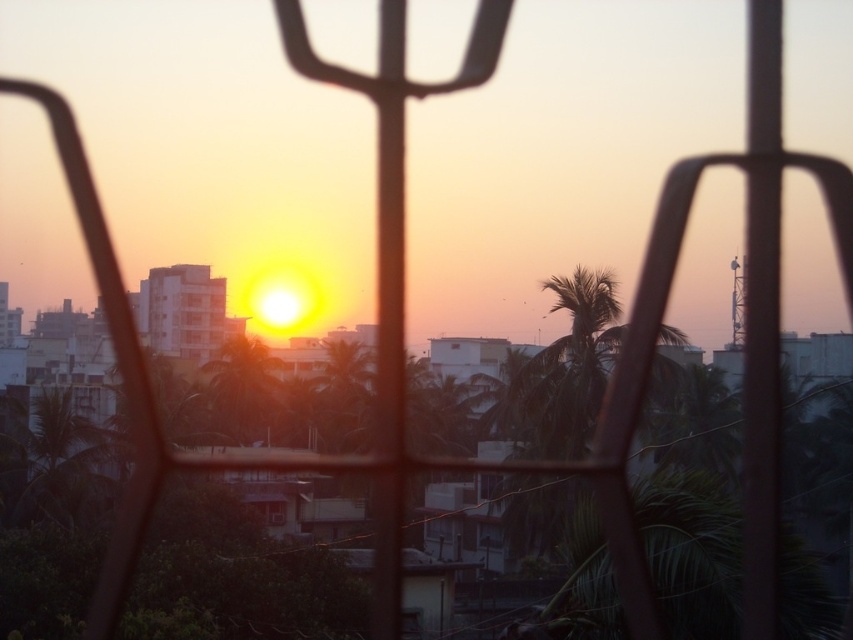
You are standing in front of a window with a metal grid and looking at the sunset. There are two points marked on the grid at coordinates point (262, 403) and point (265, 509). Which of these two points is closer to you?

Point (262, 403) is further to the camera than point (265, 509), so the point closer to you is point (265, 509).

You are standing at the center of the metal grid in the foreground of the sunset scene. You notice a point marked at coordinates (242, 392). What object is located at that point?

The point at (242, 392) is where the green leafy palm tree at center is located.

In the scene shown: You are standing in a room with a view of a sunset. You see a green leafy palm tree at center and a transparent glass window at center. Which object is closer to you?

The green leafy palm tree at center is closer to you than the transparent glass window at center because the window is behind the palm tree.